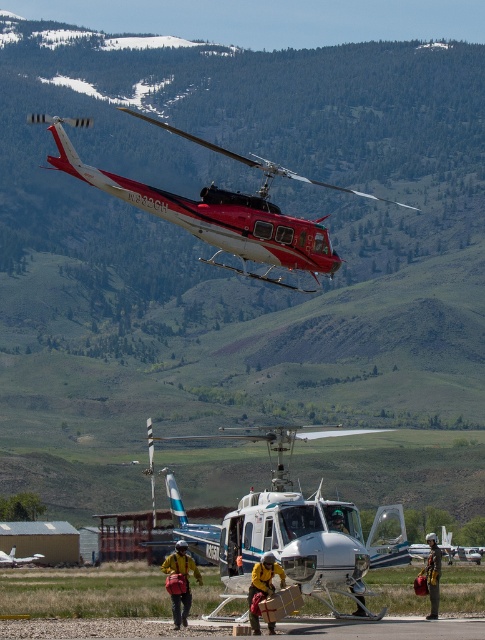
Question: Is metallic red helicopter at upper center below yellow fabric jacket at center?

Choices:
 (A) yes
 (B) no

Answer: (B)

Question: Which point appears closest to the camera in this image?

Choices:
 (A) [301, 256]
 (B) [263, 579]
 (C) [187, 579]
 (D) [276, 516]

Answer: (B)

Question: Which of the following is the closest to the observer?

Choices:
 (A) (82, 125)
 (B) (269, 552)

Answer: (B)

Question: From the image, what is the correct spatial relationship of white metallic helicopter at center in relation to yellow fabric jacket at center?

Choices:
 (A) right
 (B) left

Answer: (A)

Question: Which point is farther from the camera taking this photo?

Choices:
 (A) (261, 566)
 (B) (181, 579)

Answer: (B)

Question: Considering the relative positions of white metallic helicopter at center and metallic red helicopter at upper center in the image provided, where is white metallic helicopter at center located with respect to metallic red helicopter at upper center?

Choices:
 (A) right
 (B) left

Answer: (A)